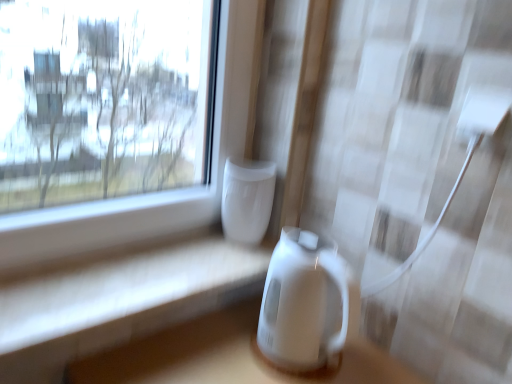
Where is `free space in front of white glossy vase at center, which is the second appliance from bottom to top`? This screenshot has width=512, height=384. free space in front of white glossy vase at center, which is the second appliance from bottom to top is located at coordinates (212, 263).